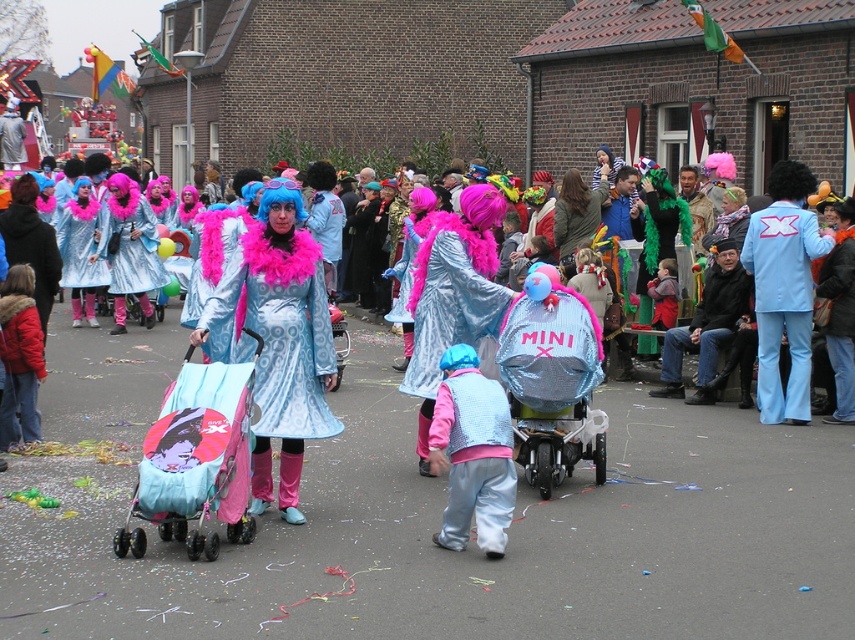
You are a photographer trying to capture a photo of both the matte pink fabric baby carriage at center and the light blue fabric suit at right in the same frame. Based on their heights, which object should you position closer to the camera to ensure both are fully visible in the photo?

The matte pink fabric baby carriage at center has a lesser height compared to the light blue fabric suit at right. To ensure both are fully visible, position the shorter matte pink fabric baby carriage at center closer to the camera so its height matches the taller light blue fabric suit at right in the frame.

You are a photographer trying to capture a photo of the light blue fabric suit at right and the shiny metallic coat at center. Based on their positions, which object should you focus on first if you want to include both in your frame without moving the camera?

The light blue fabric suit at right is to the right of the shiny metallic coat at center, so you should focus on the shiny metallic coat at center first to ensure both are in the frame.